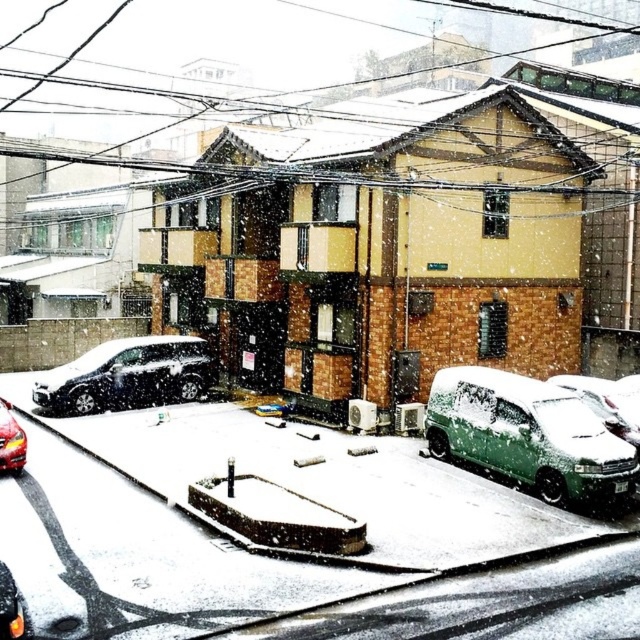
Question: Is green matte van at lower right positioned behind shiny black car at lower left?

Choices:
 (A) no
 (B) yes

Answer: (B)

Question: Is the position of shiny black sedan at left less distant than that of shiny red car at lower left?

Choices:
 (A) no
 (B) yes

Answer: (A)

Question: Which object appears closest to the camera in this image?

Choices:
 (A) shiny red car at lower left
 (B) shiny black car at lower left
 (C) green matte van at lower right
 (D) green matte van at right

Answer: (B)

Question: Which of the following is the farthest from the observer?

Choices:
 (A) shiny black sedan at left
 (B) shiny black car at lower left
 (C) shiny red car at lower left

Answer: (A)

Question: Observing the image, what is the correct spatial positioning of shiny black sedan at left in reference to shiny red car at lower left?

Choices:
 (A) right
 (B) left

Answer: (A)

Question: Which object is the closest to the shiny black sedan at left?

Choices:
 (A) shiny red car at lower left
 (B) green matte van at right
 (C) shiny black car at lower left
 (D) green matte van at lower right

Answer: (A)